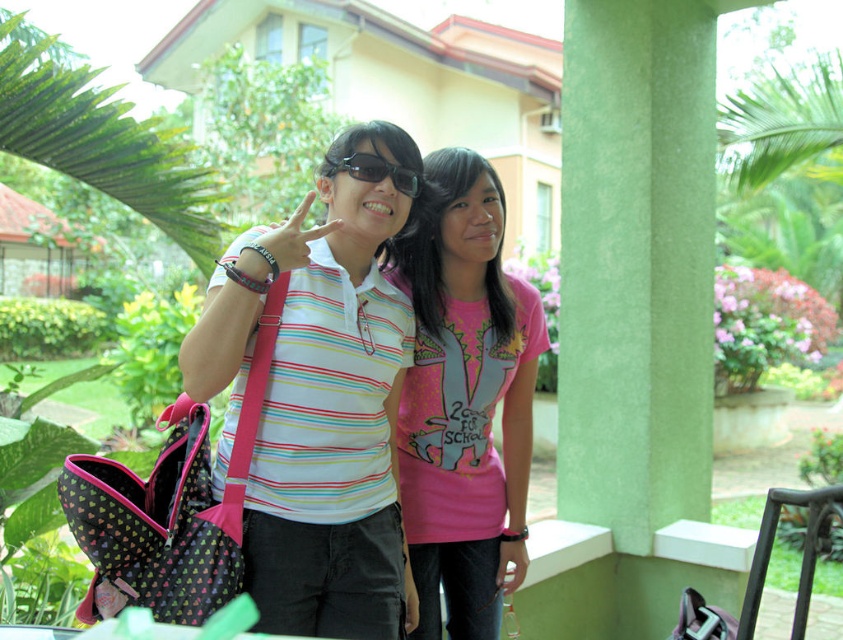
Question: Considering the relative positions of pink matte t-shirt at center and matte black sunglasses at center in the image provided, where is pink matte t-shirt at center located with respect to matte black sunglasses at center?

Choices:
 (A) right
 (B) left

Answer: (A)

Question: In this image, where is pink matte t-shirt at center located relative to matte black sunglasses at center?

Choices:
 (A) below
 (B) above

Answer: (A)

Question: Which of the following is the farthest from the observer?

Choices:
 (A) pink matte t-shirt at center
 (B) matte black sunglasses at center
 (C) striped cotton shirt at center

Answer: (A)

Question: Based on their relative distances, which object is farther from the pink matte t-shirt at center?

Choices:
 (A) matte black sunglasses at center
 (B) striped cotton shirt at center

Answer: (A)

Question: Considering the relative positions of striped cotton shirt at center and matte black sunglasses at center in the image provided, where is striped cotton shirt at center located with respect to matte black sunglasses at center?

Choices:
 (A) above
 (B) below

Answer: (B)

Question: Which point appears closest to the camera in this image?

Choices:
 (A) pos(392,180)
 (B) pos(454,452)

Answer: (A)